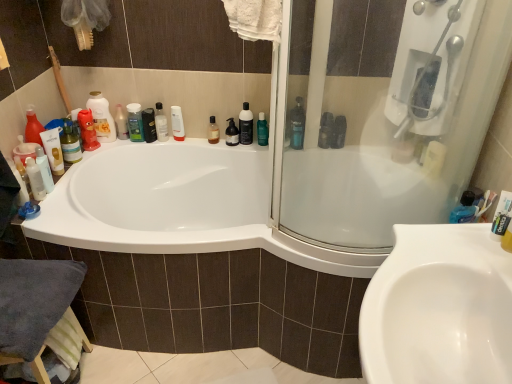
Question: Considering the relative positions of black pump bottle at upper center, which ranks as the 1th toiletry in right-to-left order, and green matte shampoo at upper left, the second toiletry when ordered from right to left, in the image provided, is black pump bottle at upper center, which ranks as the 1th toiletry in right-to-left order, in front of green matte shampoo at upper left, the second toiletry when ordered from right to left,?

Choices:
 (A) no
 (B) yes

Answer: (A)

Question: Is black pump bottle at upper center, which ranks as the 1th toiletry in right-to-left order, next to green matte shampoo at upper left, the second toiletry when ordered from right to left?

Choices:
 (A) yes
 (B) no

Answer: (B)

Question: Does black pump bottle at upper center, which ranks as the 1th toiletry in right-to-left order, have a smaller size compared to green matte shampoo at upper left, the second toiletry when ordered from right to left?

Choices:
 (A) yes
 (B) no

Answer: (A)

Question: Is black pump bottle at upper center, which ranks as the 1th toiletry in right-to-left order, at the left side of green matte shampoo at upper left, the 2th toiletry positioned from the left?

Choices:
 (A) yes
 (B) no

Answer: (B)

Question: From the image's perspective, is black pump bottle at upper center, which ranks as the 1th toiletry in right-to-left order, located beneath green matte shampoo at upper left, the 2th toiletry positioned from the left?

Choices:
 (A) no
 (B) yes

Answer: (B)

Question: Looking at the image, does black pump bottle at upper center, which ranks as the 1th toiletry in right-to-left order, seem bigger or smaller compared to matte white lotion at upper center, which ranks as the first toiletry in left-to-right order?

Choices:
 (A) big
 (B) small

Answer: (A)

Question: In the image, is black pump bottle at upper center, which ranks as the 3th toiletry in left-to-right order, positioned in front of or behind matte white lotion at upper center, positioned as the 3th toiletry in right-to-left order?

Choices:
 (A) front
 (B) behind

Answer: (A)

Question: Is point (237, 137) closer or farther from the camera than point (120, 127)?

Choices:
 (A) farther
 (B) closer

Answer: (B)

Question: Is black pump bottle at upper center, which ranks as the 1th toiletry in right-to-left order, to the left or to the right of matte white lotion at upper center, positioned as the 3th toiletry in right-to-left order, in the image?

Choices:
 (A) left
 (B) right

Answer: (B)

Question: From a real-world perspective, relative to green matte bottle at upper center, which is the first mouthwash from right to left, is matte white lotion at upper center, positioned as the 3th toiletry in right-to-left order, vertically above or below?

Choices:
 (A) above
 (B) below

Answer: (A)

Question: Relative to green matte bottle at upper center, positioned as the fourth mouthwash in left-to-right order, is matte white lotion at upper center, positioned as the 3th toiletry in right-to-left order, in front or behind?

Choices:
 (A) front
 (B) behind

Answer: (B)

Question: In terms of width, does matte white lotion at upper center, which ranks as the first toiletry in left-to-right order, look wider or thinner when compared to green matte bottle at upper center, positioned as the fourth mouthwash in left-to-right order?

Choices:
 (A) wide
 (B) thin

Answer: (B)

Question: From the image's perspective, is matte white lotion at upper center, which ranks as the first toiletry in left-to-right order, positioned above or below green matte bottle at upper center, which is the first mouthwash from right to left?

Choices:
 (A) above
 (B) below

Answer: (A)

Question: Considering their positions, is brown glass bottle at upper center, which appears as the third mouthwash when viewed from the right, located in front of or behind blue glossy bottle at upper right, the 4th cleaning product positioned from the left?

Choices:
 (A) behind
 (B) front

Answer: (A)

Question: From a real-world perspective, is brown glass bottle at upper center, the second mouthwash positioned from the left, positioned above or below blue glossy bottle at upper right, the 4th cleaning product positioned from the left?

Choices:
 (A) below
 (B) above

Answer: (A)